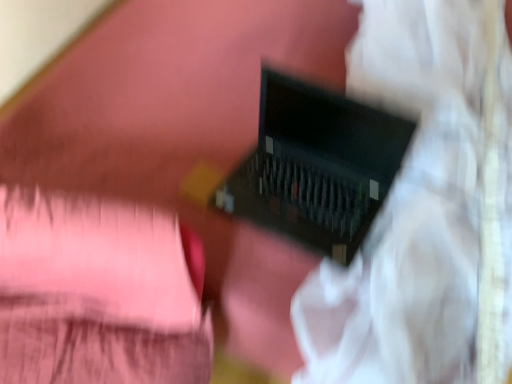
Describe the element at coordinates (409, 211) in the screenshot. I see `matte black laptop at center` at that location.

Find the location of a particular element. matte black laptop at center is located at coordinates (409, 211).

Where is `black plastic computer at center`? Image resolution: width=512 pixels, height=384 pixels. black plastic computer at center is located at coordinates (316, 166).

This screenshot has width=512, height=384. What do you see at coordinates (316, 166) in the screenshot?
I see `black plastic computer at center` at bounding box center [316, 166].

Find the location of a particular element. This screenshot has width=512, height=384. matte black laptop at center is located at coordinates (409, 211).

Is black plastic computer at center to the left or to the right of matte black laptop at center in the image?

Clearly, black plastic computer at center is on the left of matte black laptop at center in the image.

Considering their positions, is black plastic computer at center located in front of or behind matte black laptop at center?

Clearly, black plastic computer at center is behind matte black laptop at center.

In the scene shown: Which is closer, (348,187) or (461,249)?

Point (348,187) appears to be farther away from the viewer than point (461,249).

From the image's perspective, does black plastic computer at center appear lower than matte black laptop at center?

Indeed, from the image's perspective, black plastic computer at center is shown beneath matte black laptop at center.

From a real-world perspective, is black plastic computer at center located beneath matte black laptop at center?

No, from a real-world perspective, black plastic computer at center is not beneath matte black laptop at center.

Can you confirm if black plastic computer at center is wider than matte black laptop at center?

No.

Does black plastic computer at center have a greater height compared to matte black laptop at center?

No, black plastic computer at center is not taller than matte black laptop at center.

Considering the relative sizes of black plastic computer at center and matte black laptop at center in the image provided, is black plastic computer at center smaller than matte black laptop at center?

Indeed, black plastic computer at center has a smaller size compared to matte black laptop at center.

Which is correct: black plastic computer at center is inside matte black laptop at center, or outside of it?

black plastic computer at center fits inside matte black laptop at center.

In the scene shown: Is black plastic computer at center not close to matte black laptop at center?

Actually, black plastic computer at center and matte black laptop at center are a little close together.

Is black plastic computer at center positioned with its back to matte black laptop at center?

Yes, matte black laptop at center is at the back of black plastic computer at center.

Can you tell me how much black plastic computer at center and matte black laptop at center differ in facing direction?

There is a 3.58-degree angle between the facing directions of black plastic computer at center and matte black laptop at center.

You are a GUI agent. You are given a task and a screenshot of the screen. Output one action in this format:
    pyautogui.click(x=<x>, y=<y>)
    Task: Click on the computer located above the matte black laptop at center (from a real-world perspective)
    
    Given the screenshot: What is the action you would take?
    pyautogui.click(x=316, y=166)

Is matte black laptop at center at the left side of black plastic computer at center?

No, matte black laptop at center is not to the left of black plastic computer at center.

Does matte black laptop at center lie behind black plastic computer at center?

Answer: No, matte black laptop at center is in front of black plastic computer at center.

Which is closer to the camera, (437, 200) or (331, 120)?

Point (437, 200) is positioned closer to the camera compared to point (331, 120).

From the image's perspective, which is below, matte black laptop at center or black plastic computer at center?

black plastic computer at center appears lower in the image.

From a real-world perspective, is matte black laptop at center on top of black plastic computer at center?

Incorrect, from a real-world perspective, matte black laptop at center is lower than black plastic computer at center.

Is matte black laptop at center wider than black plastic computer at center?

Indeed, matte black laptop at center has a greater width compared to black plastic computer at center.

Considering the sizes of objects matte black laptop at center and black plastic computer at center in the image provided, who is shorter, matte black laptop at center or black plastic computer at center?

black plastic computer at center.

Is matte black laptop at center bigger than black plastic computer at center?

Correct, matte black laptop at center is larger in size than black plastic computer at center.

Looking at this image, is black plastic computer at center surrounded by matte black laptop at center?

Yes, matte black laptop at center is surrounding black plastic computer at center.

Are matte black laptop at center and black plastic computer at center located far from each other?

No, matte black laptop at center is in close proximity to black plastic computer at center.

Is black plastic computer at center at the back of matte black laptop at center?

No, matte black laptop at center's orientation is not away from black plastic computer at center.

How different are the orientations of matte black laptop at center and black plastic computer at center in degrees?

matte black laptop at center and black plastic computer at center are facing 3.58 degrees away from each other.

You are a GUI agent. You are given a task and a screenshot of the screen. Output one action in this format:
    pyautogui.click(x=<x>, y=<y>)
    Task: Click on the computer above the matte black laptop at center (from a real-world perspective)
    This screenshot has width=512, height=384.
    Given the screenshot: What is the action you would take?
    pyautogui.click(x=316, y=166)

Find the location of a particular element. computer behind the matte black laptop at center is located at coordinates (316, 166).

Identify the location of computer to the left of matte black laptop at center. (316, 166).